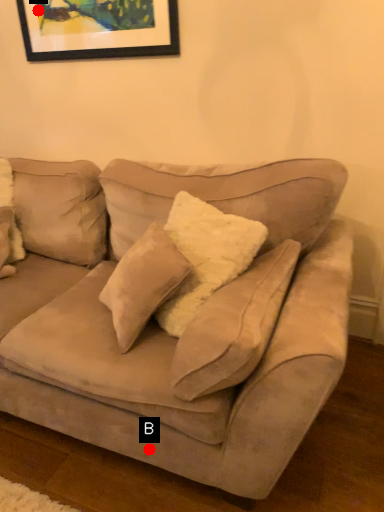
Question: Two points are circled on the image, labeled by A and B beside each circle. Which point appears farthest from the camera in this image?

Choices:
 (A) A is further
 (B) B is further

Answer: (A)